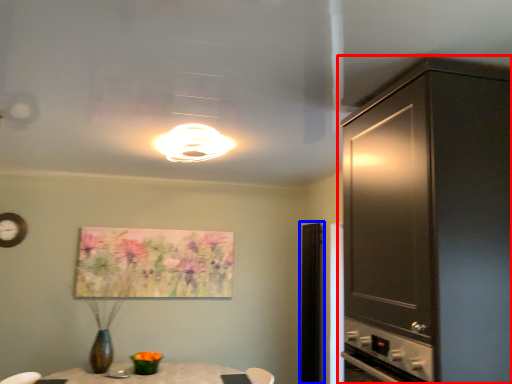
Question: Which point is closer to the camera, cabinetry (highlighted by a red box) or glass door (highlighted by a blue box)?

Choices:
 (A) cabinetry
 (B) glass door

Answer: (A)